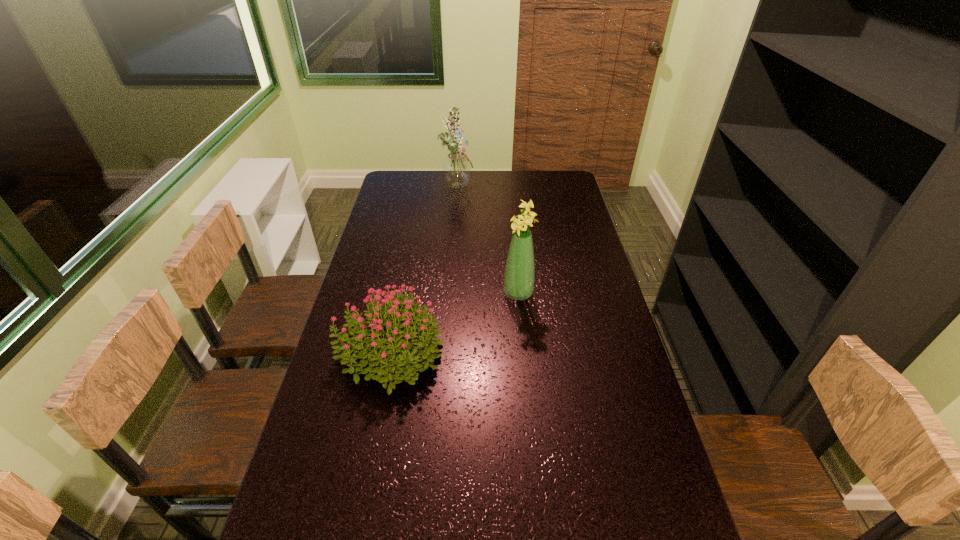
At what (x,y) coordinates should I click in order to perform the action: click on the farthest object. Please return your answer as a coordinate pair (x, y). Image resolution: width=960 pixels, height=540 pixels. Looking at the image, I should click on (456, 167).

Image resolution: width=960 pixels, height=540 pixels. I want to click on the rightmost object, so click(519, 276).

Identify the location of the second nearest bouquet. (519, 276).

In order to click on the nearest object in this screenshot , I will do 383,356.

The height and width of the screenshot is (540, 960). What are the coordinates of `the nearest bouquet` in the screenshot? It's located at (383, 356).

You are a GUI agent. You are given a task and a screenshot of the screen. Output one action in this format:
    pyautogui.click(x=<x>, y=<y>)
    Task: Click on the free point located on the front-facing side of the farthest bouquet
    The width and height of the screenshot is (960, 540).
    Given the screenshot: What is the action you would take?
    pyautogui.click(x=508, y=184)

I want to click on free space located 0.270m on the front-facing side of the second farthest bouquet, so click(422, 294).

I want to click on vacant region located on the front-facing side of the second farthest bouquet, so click(462, 294).

Identify the location of vacant space situated 0.290m on the front-facing side of the second farthest bouquet. (417, 294).

Locate an element on the screen. free space located 0.340m on the right of the shortest bouquet is located at coordinates (560, 351).